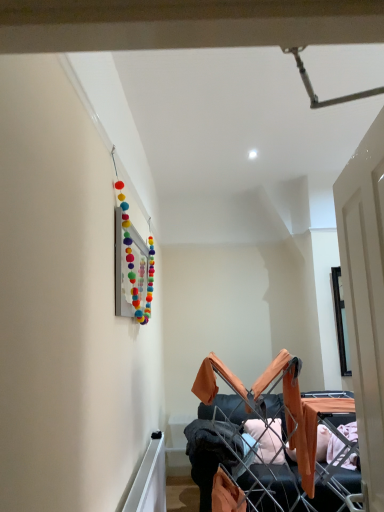
Question: From a real-world perspective, relative to dark gray fabric at center, is white wooden door at right vertically above or below?

Choices:
 (A) above
 (B) below

Answer: (A)

Question: Is white wooden door at right bigger or smaller than dark gray fabric at center?

Choices:
 (A) small
 (B) big

Answer: (B)

Question: Considering the real-world distances, which object is farthest from the dark gray fabric at center?

Choices:
 (A) orange fabric drying rack at lower right
 (B) white wooden door at right

Answer: (B)

Question: Considering the real-world distances, which object is closest to the orange fabric drying rack at lower right?

Choices:
 (A) white wooden door at right
 (B) dark gray fabric at center

Answer: (B)